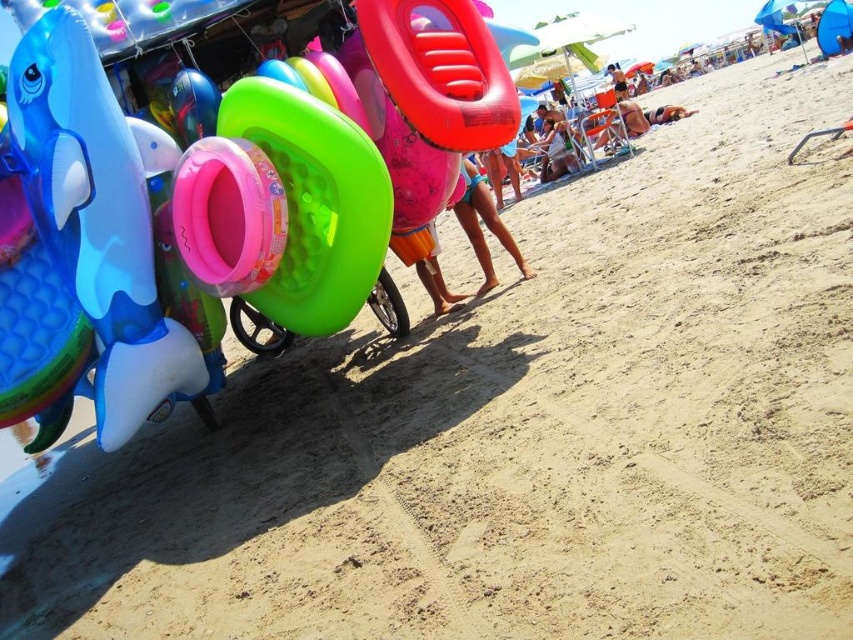
Question: Can you confirm if pink matte swimsuit at center is positioned to the left of tan skin person at lower right?

Choices:
 (A) no
 (B) yes

Answer: (B)

Question: Where is pink matte swimsuit at center located in relation to orange cotton shorts at center in the image?

Choices:
 (A) left
 (B) right

Answer: (B)

Question: Which of the following is the farthest from the observer?

Choices:
 (A) pink matte swimsuit at center
 (B) rubber inflatable ring at left
 (C) orange cotton shorts at center
 (D) tan skin person at lower right

Answer: (D)

Question: Which object appears farthest from the camera in this image?

Choices:
 (A) pink matte swimsuit at center
 (B) rubber inflatable ring at left
 (C) tan skin person at lower right

Answer: (C)

Question: Among these objects, which one is farthest from the camera?

Choices:
 (A) blue rubber dolphin at left
 (B) orange cotton shorts at center
 (C) tan skin person at lower right

Answer: (C)

Question: Does blue rubber dolphin at left have a larger size compared to orange cotton shorts at center?

Choices:
 (A) no
 (B) yes

Answer: (B)